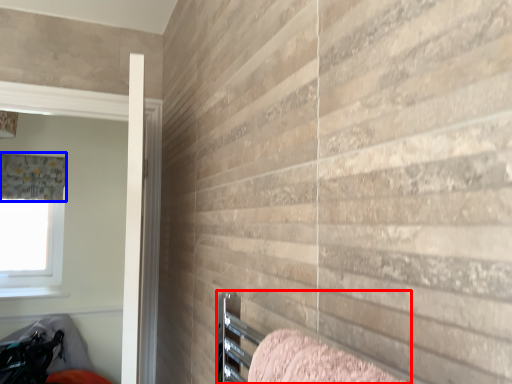
Question: Which point is further to the camera, bed (highlighted by a red box) or curtain (highlighted by a blue box)?

Choices:
 (A) bed
 (B) curtain

Answer: (B)